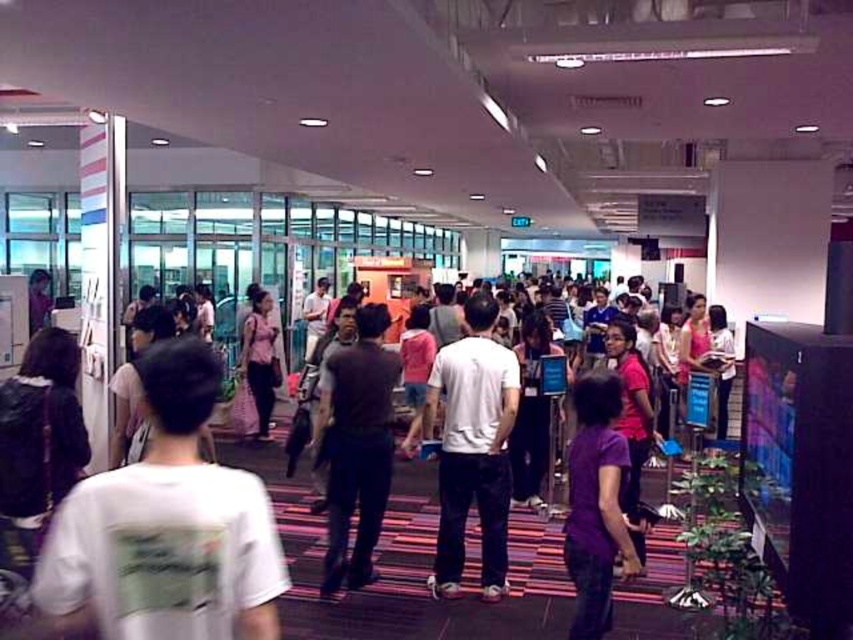
You are a photographer trying to capture a group photo of the dark brown shirt at center and the purple matte shirt at center. Since you want to frame them properly, which one should you place on the left side of the frame?

The dark brown shirt at center should be placed on the left side of the frame because it is already positioned on the left side of the purple matte shirt at center in the scene.